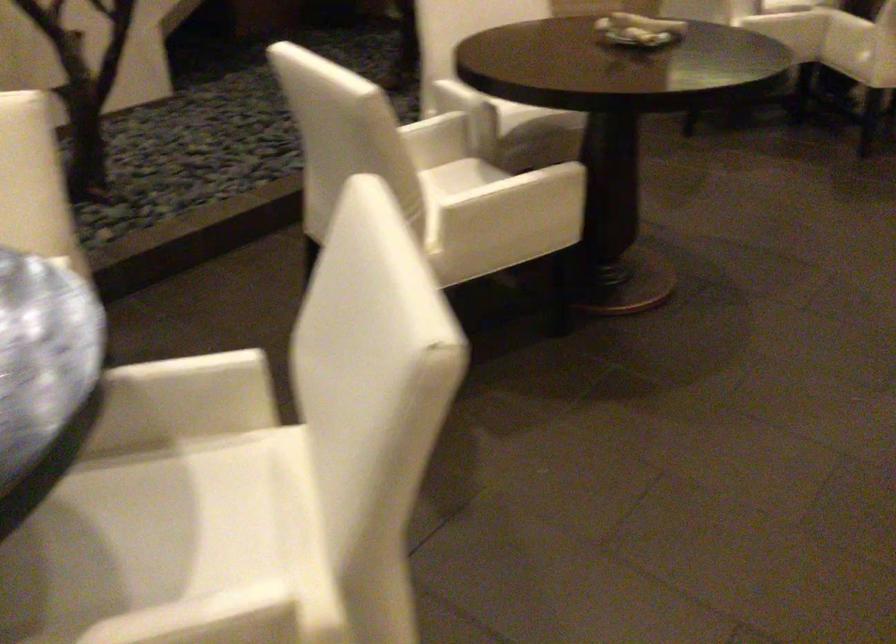
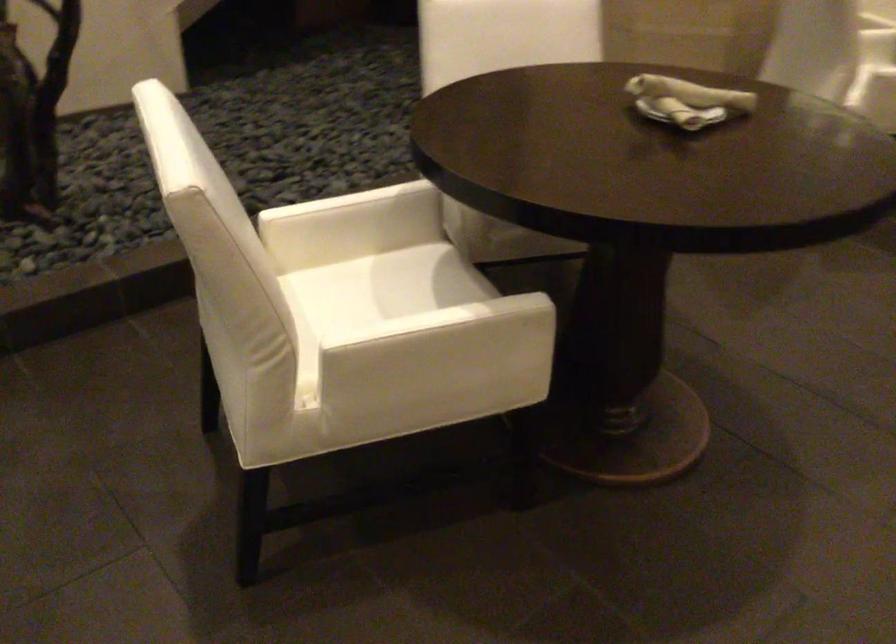
What movement of the cameraman would produce the second image?

The cameraman walked toward right, forward.